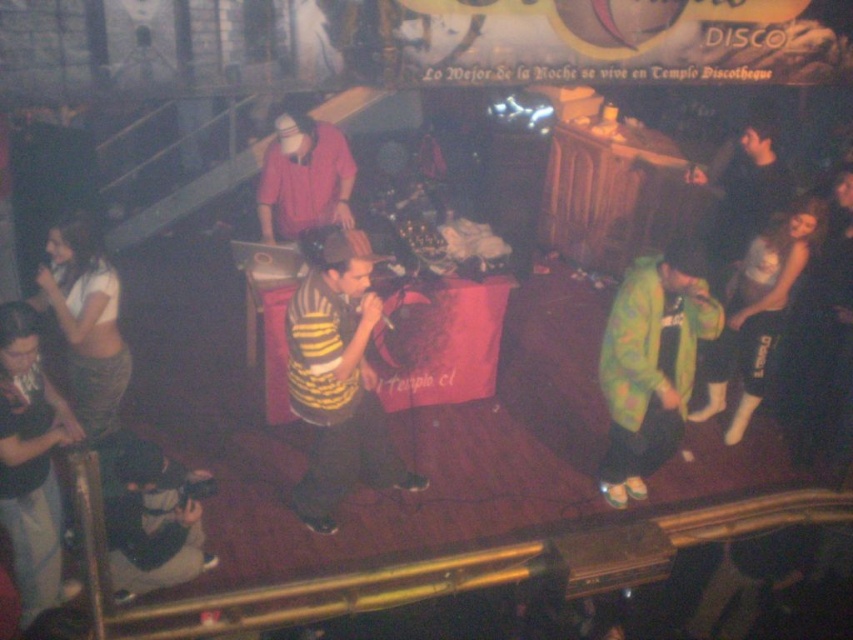
Question: Does yellow striped shirt at center have a smaller size compared to matte pink shirt at center?

Choices:
 (A) no
 (B) yes

Answer: (A)

Question: Observing the image, what is the correct spatial positioning of green matte jacket at lower right in reference to matte pink shirt at center?

Choices:
 (A) above
 (B) below

Answer: (B)

Question: Is green matte jacket at lower right bigger than white fabric skirt at lower left?

Choices:
 (A) yes
 (B) no

Answer: (A)

Question: Which of these objects is positioned closest to the green matte jacket at lower right?

Choices:
 (A) white fabric skirt at lower left
 (B) yellow striped shirt at center

Answer: (B)

Question: Which object is closer to the camera taking this photo?

Choices:
 (A) matte pink shirt at center
 (B) yellow striped shirt at center

Answer: (B)

Question: Which object is farther from the camera taking this photo?

Choices:
 (A) white fabric skirt at lower left
 (B) yellow striped shirt at center
 (C) green matte jacket at lower right
 (D) matte pink shirt at center

Answer: (D)